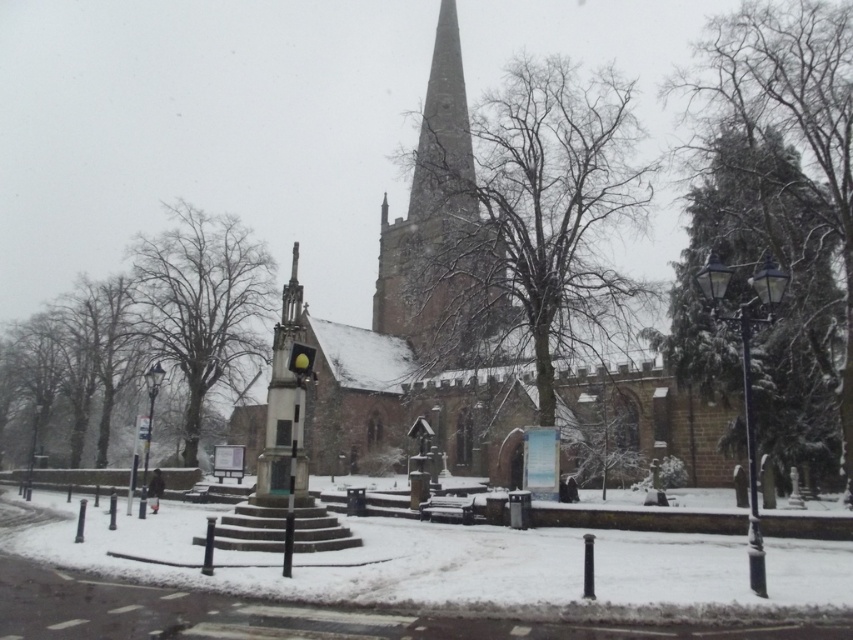
You are standing at the edge of the snow covered road and want to take a photo of the brown stone church at center. If your camera can focus on objects up to 50 meters away, will it be able to capture the church clearly?

The brown stone church at center is 50.02 meters away from camera. Since the camera can focus up to 50 meters, it is just slightly beyond the camera range. Therefore, the camera might not be able to capture the church clearly.

You are standing in front of the historic church and want to take a photo that includes both the point at coordinates point (708, 467) and point (436, 81). Based on their positions, which point will appear larger in your camera view?

Point (708, 467) is closer to the camera than point (436, 81), so it will appear larger in the camera view.

You are planning to take a photograph of the brown stone church at center and the smooth stone spire at center. Based on their widths, which one should you focus on to ensure it fits entirely within your camera frame?

The brown stone church at center might be wider than the smooth stone spire at center, so focusing on the church would be better to ensure it fits within the camera frame.